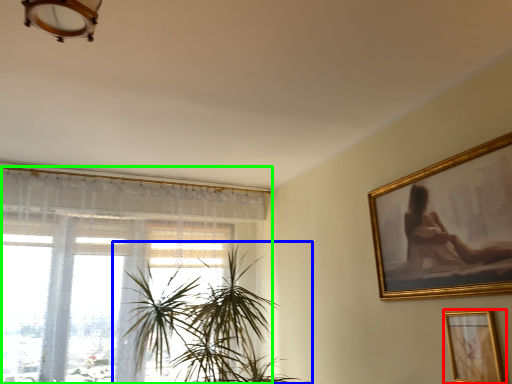
Question: Which object is the closest to the picture frame (highlighted by a red box)? Choose among these: houseplant (highlighted by a blue box) or window (highlighted by a green box).

Choices:
 (A) houseplant
 (B) window

Answer: (A)